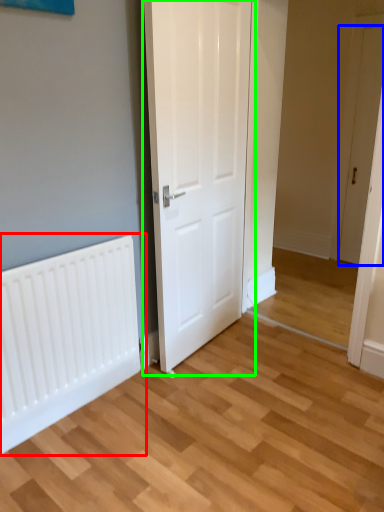
Question: Considering the real-world distances, which object is closest to radiator (highlighted by a red box)? door (highlighted by a blue box) or door (highlighted by a green box).

Choices:
 (A) door
 (B) door

Answer: (B)